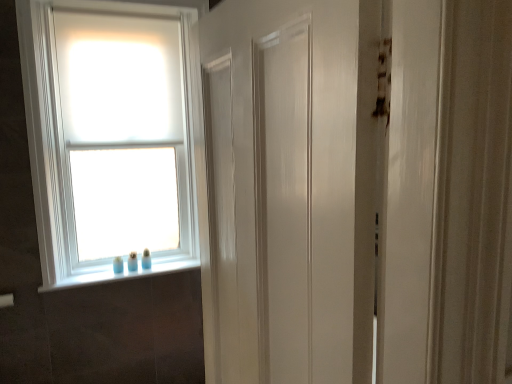
Question: Considering the relative positions of white glossy window sill at lower left and white matte window at upper left in the image provided, is white glossy window sill at lower left to the left or to the right of white matte window at upper left?

Choices:
 (A) left
 (B) right

Answer: (B)

Question: Considering their positions, is white glossy window sill at lower left located in front of or behind white matte window at upper left?

Choices:
 (A) front
 (B) behind

Answer: (B)

Question: Is point (95, 276) closer or farther from the camera than point (66, 59)?

Choices:
 (A) farther
 (B) closer

Answer: (A)

Question: Would you say white matte window at upper left is to the left or to the right of white glossy window sill at lower left in the picture?

Choices:
 (A) left
 (B) right

Answer: (A)

Question: From their relative heights in the image, would you say white matte window at upper left is taller or shorter than white glossy window sill at lower left?

Choices:
 (A) tall
 (B) short

Answer: (A)

Question: From a real-world perspective, relative to white glossy window sill at lower left, is white matte window at upper left vertically above or below?

Choices:
 (A) below
 (B) above

Answer: (B)

Question: Would you say white matte window at upper left is inside or outside white glossy window sill at lower left?

Choices:
 (A) outside
 (B) inside

Answer: (A)